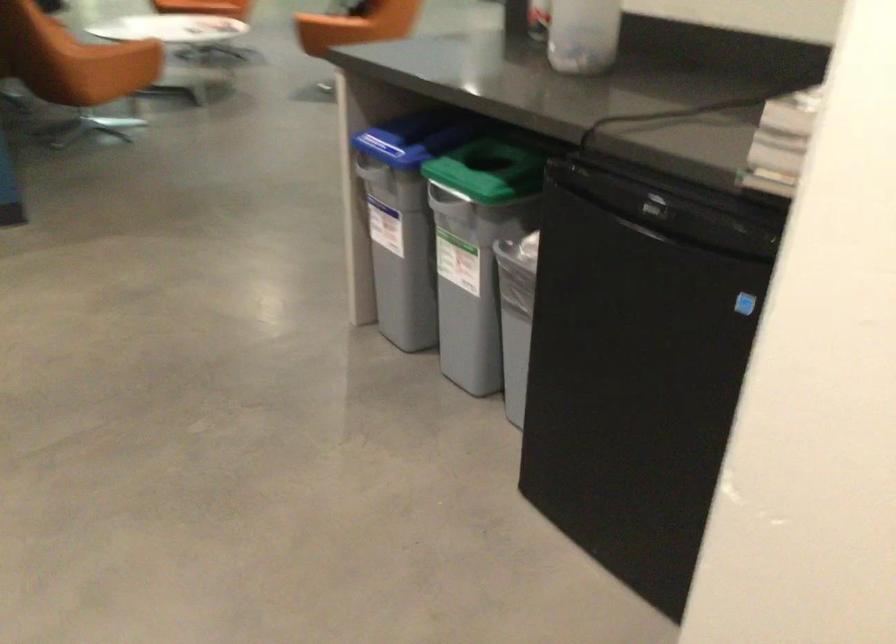
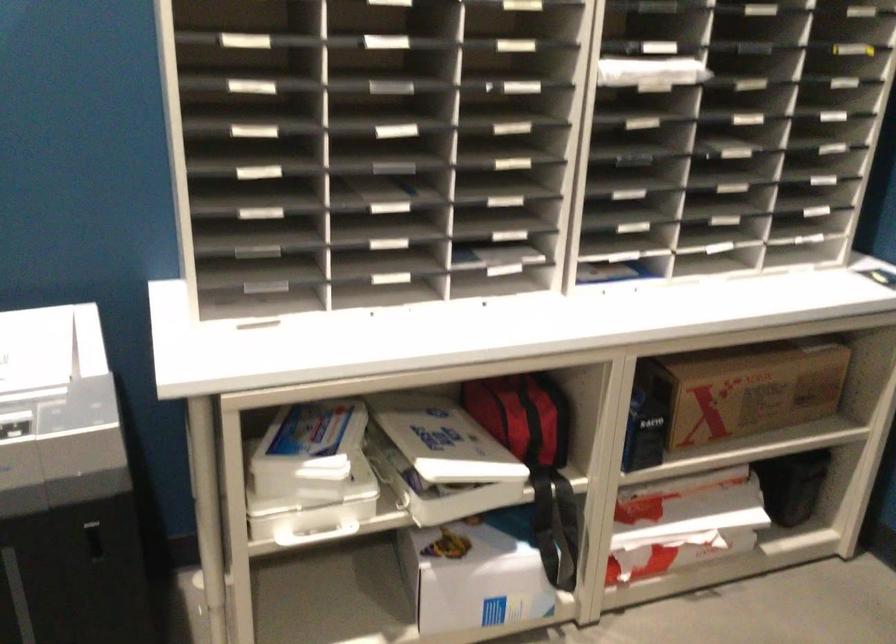
The images are taken continuously from a first-person perspective. In which direction are you moving?

The cameraman walked toward left, forward.